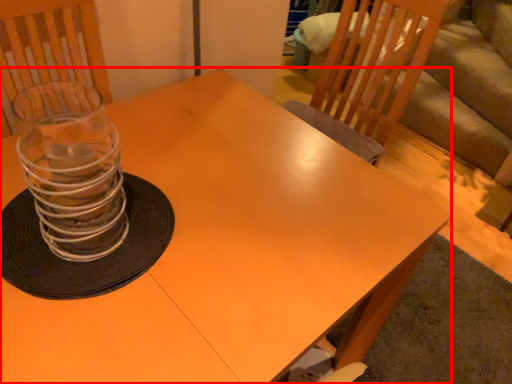
Question: Where is table (annotated by the red box) located in relation to candle holder in the image?

Choices:
 (A) right
 (B) left

Answer: (A)